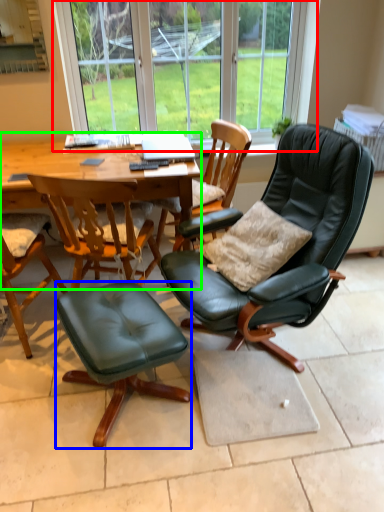
Question: Based on their relative distances, which object is nearer to bay window (highlighted by a red box)? Choose from stool (highlighted by a blue box) and round table (highlighted by a green box).

Choices:
 (A) stool
 (B) round table

Answer: (B)